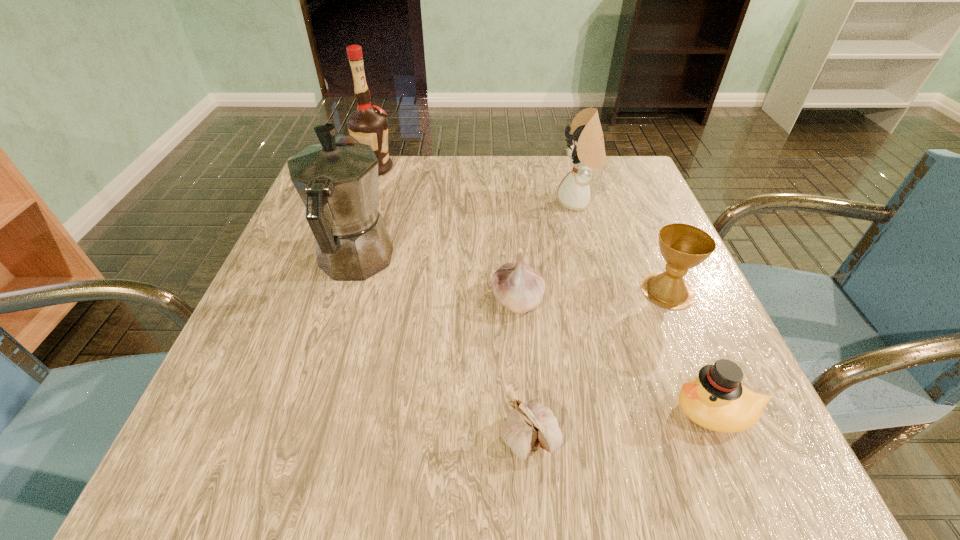
Find the location of a particular element. This screenshot has height=540, width=960. liquor is located at coordinates (368, 124).

Locate an element on the screen. This screenshot has height=540, width=960. coffeepot is located at coordinates (337, 180).

At what (x,y) coordinates should I click in order to perform the action: click on the fifth object from left to right. Please return your answer as a coordinate pair (x, y). Looking at the image, I should click on (586, 149).

The height and width of the screenshot is (540, 960). Find the location of `doll`. doll is located at coordinates (x=586, y=149).

The image size is (960, 540). In order to click on chalice in this screenshot , I will do `click(683, 246)`.

Find the location of a particular element. the farther garlic is located at coordinates (517, 286).

You are a GUI agent. You are given a task and a screenshot of the screen. Output one action in this format:
    pyautogui.click(x=<x>, y=<y>)
    Task: Click on the duck
    This screenshot has width=960, height=540.
    Given the screenshot: What is the action you would take?
    pyautogui.click(x=716, y=400)

The image size is (960, 540). In order to click on the shorter garlic in this screenshot , I will do `click(528, 426)`.

At what (x,y) coordinates should I click in order to perform the action: click on vacant area located 0.250m on the front and back of the liquor. Please return your answer as a coordinate pair (x, y). The width and height of the screenshot is (960, 540). Looking at the image, I should click on (492, 168).

The image size is (960, 540). I want to click on free point located 0.100m on the pouring side of the coffeepot, so click(374, 198).